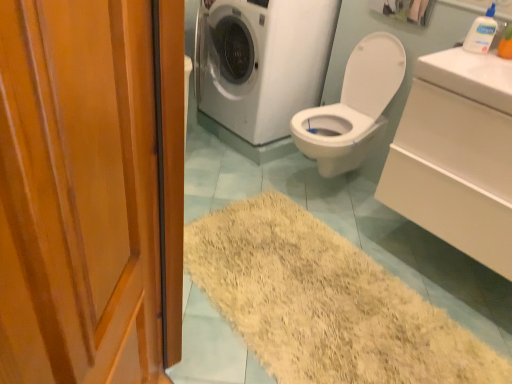
Question: Should I look upward or downward to see white glossy washing machine at upper center?

Choices:
 (A) up
 (B) down

Answer: (A)

Question: From a real-world perspective, is wooden door at left positioned over white glossy washing machine at upper center based on gravity?

Choices:
 (A) no
 (B) yes

Answer: (B)

Question: Does wooden door at left have a larger size compared to white glossy washing machine at upper center?

Choices:
 (A) no
 (B) yes

Answer: (A)

Question: Is wooden door at left far from white glossy washing machine at upper center?

Choices:
 (A) yes
 (B) no

Answer: (A)

Question: Is wooden door at left shorter than white glossy washing machine at upper center?

Choices:
 (A) yes
 (B) no

Answer: (B)

Question: From the image's perspective, is wooden door at left on top of white glossy washing machine at upper center?

Choices:
 (A) yes
 (B) no

Answer: (B)

Question: Are wooden door at left and white glossy washing machine at upper center making contact?

Choices:
 (A) no
 (B) yes

Answer: (A)

Question: Is white glossy washing machine at upper center further to camera compared to white paper towel at upper center?

Choices:
 (A) yes
 (B) no

Answer: (B)

Question: From the image's perspective, is white glossy washing machine at upper center under white paper towel at upper center?

Choices:
 (A) no
 (B) yes

Answer: (B)

Question: From a real-world perspective, is white glossy washing machine at upper center under white paper towel at upper center?

Choices:
 (A) no
 (B) yes

Answer: (B)

Question: Would you say white glossy washing machine at upper center is a long distance from white paper towel at upper center?

Choices:
 (A) no
 (B) yes

Answer: (A)

Question: Can you confirm if white glossy washing machine at upper center is bigger than white paper towel at upper center?

Choices:
 (A) no
 (B) yes

Answer: (B)

Question: Is white glossy washing machine at upper center at the right side of white paper towel at upper center?

Choices:
 (A) no
 (B) yes

Answer: (A)

Question: Are white glossy sink at upper right, the second counter top when ordered from bottom to top, and white glossy washing machine at upper center far apart?

Choices:
 (A) no
 (B) yes

Answer: (B)